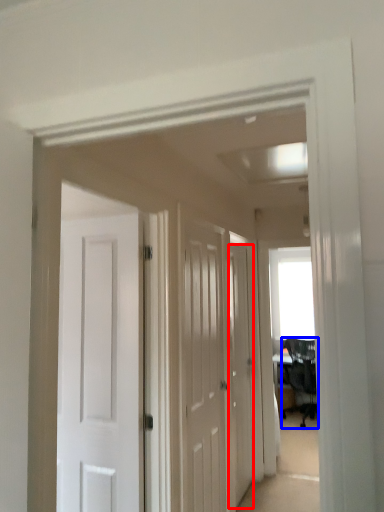
Question: Which object is closer to the camera taking this photo, door (highlighted by a red box) or chair (highlighted by a blue box)?

Choices:
 (A) door
 (B) chair

Answer: (A)